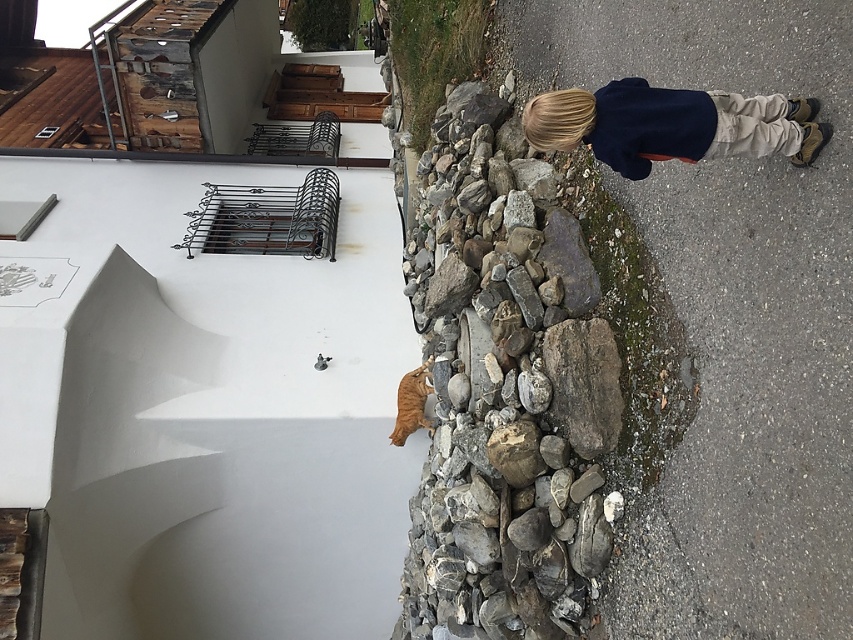
Question: Does rough gray rock at center appear on the right side of dark blue sweater at upper right?

Choices:
 (A) yes
 (B) no

Answer: (B)

Question: Among these points, which one is nearest to the camera?

Choices:
 (A) (524, 541)
 (B) (693, 120)

Answer: (B)

Question: Which point appears farthest from the camera in this image?

Choices:
 (A) (624, 140)
 (B) (527, 166)

Answer: (B)

Question: Is rough gray rock at center wider than dark blue sweater at upper right?

Choices:
 (A) no
 (B) yes

Answer: (B)

Question: Is rough gray rock at center bigger than dark blue sweater at upper right?

Choices:
 (A) yes
 (B) no

Answer: (A)